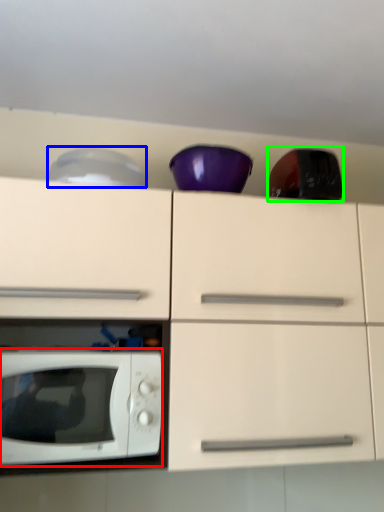
Question: Which object is positioned closest to microwave oven (highlighted by a red box)? Select from appliance (highlighted by a blue box) and appliance (highlighted by a green box).

Choices:
 (A) appliance
 (B) appliance

Answer: (A)